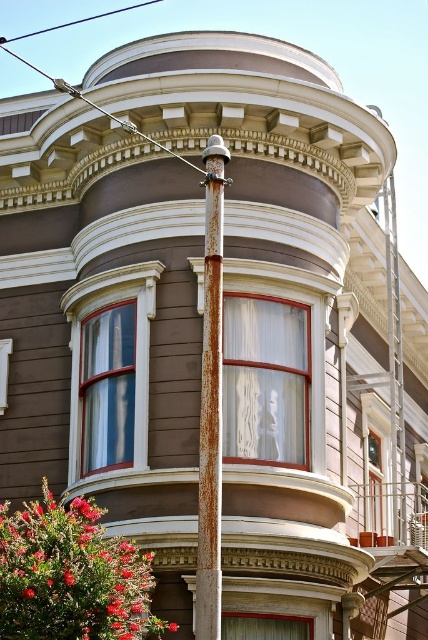
Question: In this image, where is rusty metal pole at center located relative to blue wire at upper center?

Choices:
 (A) below
 (B) above

Answer: (A)

Question: Is rusty metal pole at center below blue wire at upper center?

Choices:
 (A) no
 (B) yes

Answer: (B)

Question: Which object is farther from the camera taking this photo?

Choices:
 (A) blue wire at upper center
 (B) rusty metal pole at center

Answer: (A)

Question: Which of the following is the farthest from the observer?

Choices:
 (A) blue wire at upper center
 (B) rusty metal pole at center

Answer: (A)

Question: Is rusty metal pole at center smaller than blue wire at upper center?

Choices:
 (A) yes
 (B) no

Answer: (A)